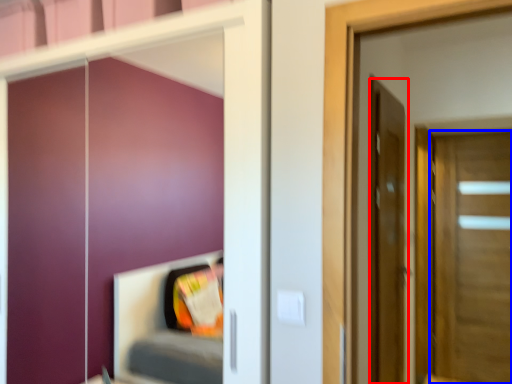
Question: Which object appears closest to the camera in this image, door (highlighted by a red box) or door (highlighted by a blue box)?

Choices:
 (A) door
 (B) door

Answer: (A)